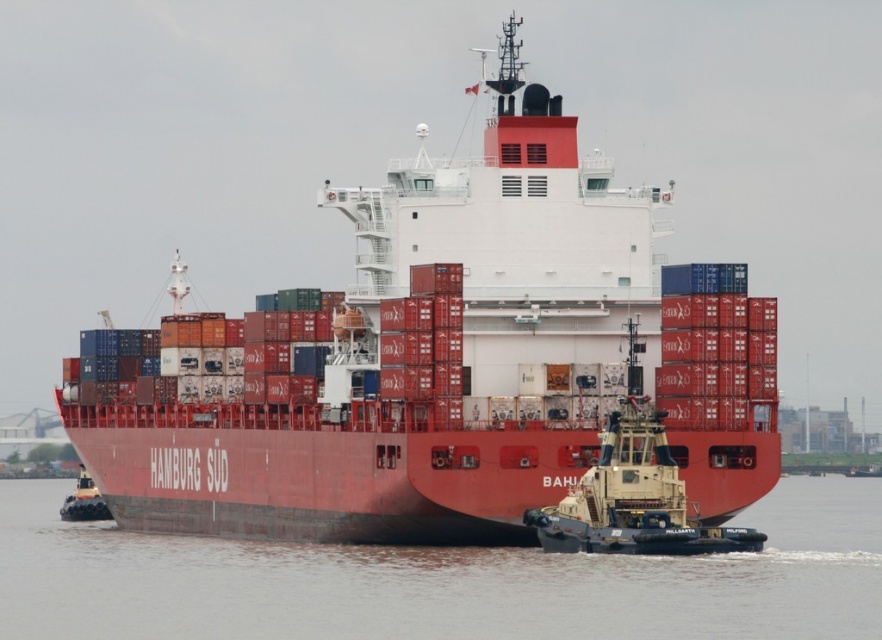
Is red matte container ship at center above camouflage paint tugboat at lower right?

Yes.

Can you confirm if red matte container ship at center is bigger than camouflage paint tugboat at lower right?

Correct, red matte container ship at center is larger in size than camouflage paint tugboat at lower right.

Between point (694, 296) and point (610, 529), which one is positioned in front?

Positioned in front is point (610, 529).

The width and height of the screenshot is (882, 640). What are the coordinates of `red matte container ship at center` in the screenshot? It's located at (442, 362).

Consider the image. Which of these two, smooth water at lower center or camouflage paint tugboat at lower right, stands taller?

camouflage paint tugboat at lower right is taller.

Looking at this image, between smooth water at lower center and camouflage paint tugboat at lower right, which one is positioned higher?

camouflage paint tugboat at lower right

Which is behind, point (290, 589) or point (644, 476)?

Point (644, 476)

Locate an element on the screen. smooth water at lower center is located at coordinates (442, 580).

Is point (123, 497) positioned after point (856, 520)?

No, (123, 497) is in front of (856, 520).

Where is `red matte container ship at center`? This screenshot has width=882, height=640. red matte container ship at center is located at coordinates (442, 362).